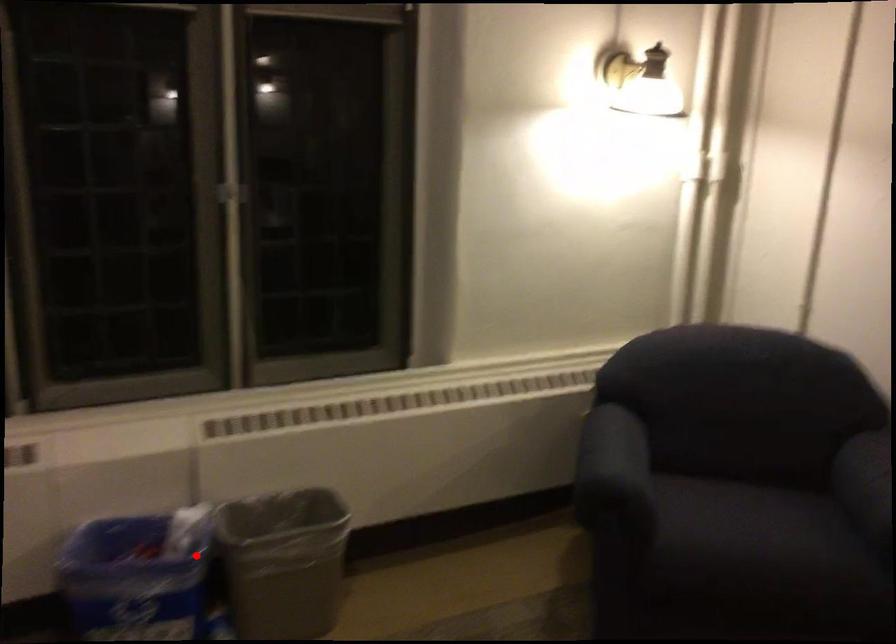
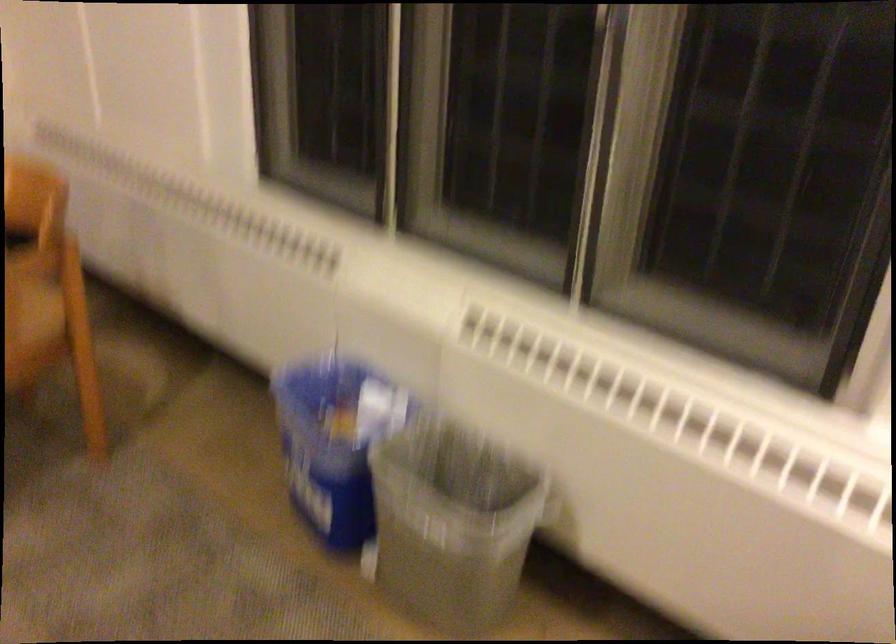
Question: I am providing you with two images of the same scene from different viewpoints. A red point is marked on the first image. At the location where the point appears in image 1, is it still visible in image 2?

Choices:
 (A) Yes
 (B) No

Answer: (A)